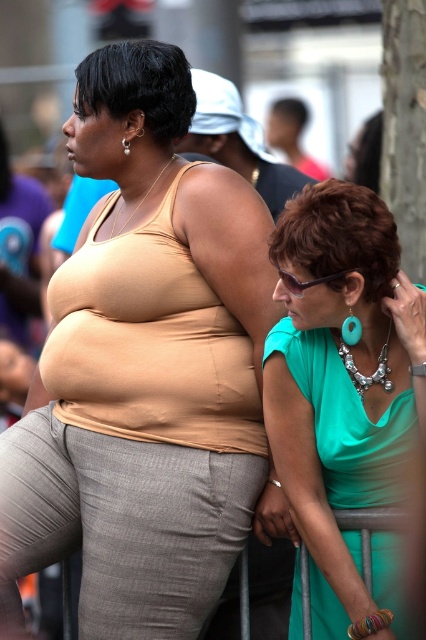
Does teal fabric dress at center have a greater width compared to sunglasses at center?

Indeed, teal fabric dress at center has a greater width compared to sunglasses at center.

Between point (345, 422) and point (301, 289), which one is positioned in front?

Point (301, 289) is in front.

This screenshot has width=426, height=640. Find the location of `teal fabric dress at center`. teal fabric dress at center is located at coordinates pos(344,396).

This screenshot has width=426, height=640. Describe the element at coordinates (146, 372) in the screenshot. I see `matte beige tank top at center` at that location.

Does matte beige tank top at center have a lesser height compared to metallic gray rail at lower center?

In fact, matte beige tank top at center may be taller than metallic gray rail at lower center.

Does point (129, 477) lie behind point (386, 513)?

Yes, point (129, 477) is behind point (386, 513).

In order to click on matte beige tank top at center in this screenshot , I will do `click(146, 372)`.

Which of these two, matte beige tank top at center or sunglasses at center, stands shorter?

sunglasses at center

Does matte beige tank top at center have a greater height compared to sunglasses at center?

Yes.

Where is `matte beige tank top at center`? Image resolution: width=426 pixels, height=640 pixels. matte beige tank top at center is located at coordinates (146, 372).

The height and width of the screenshot is (640, 426). I want to click on matte beige tank top at center, so click(146, 372).